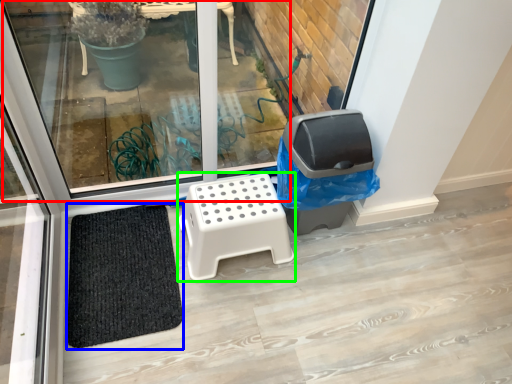
Question: Which is farther away from window (highlighted by a red box)? doormat (highlighted by a blue box) or furniture (highlighted by a green box)?

Choices:
 (A) doormat
 (B) furniture

Answer: (B)